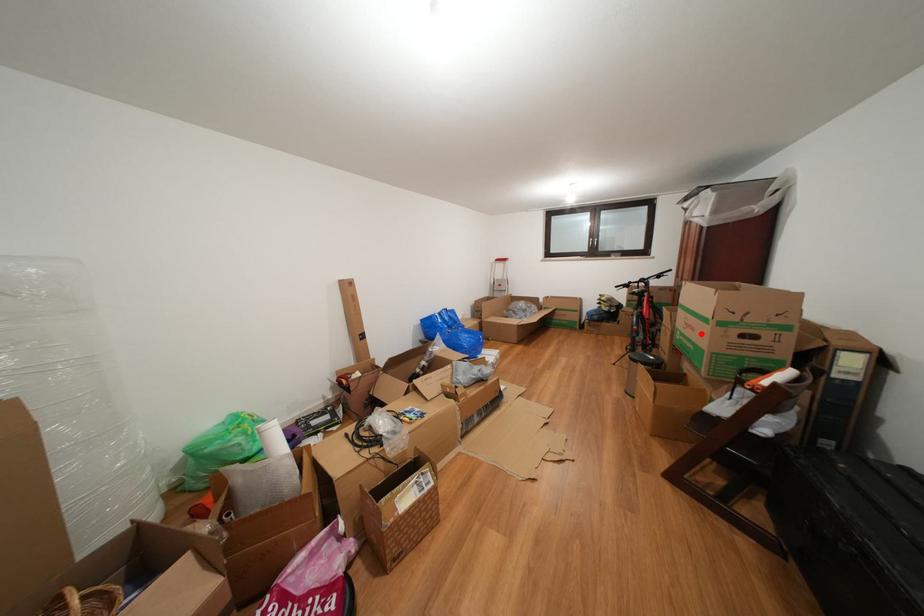
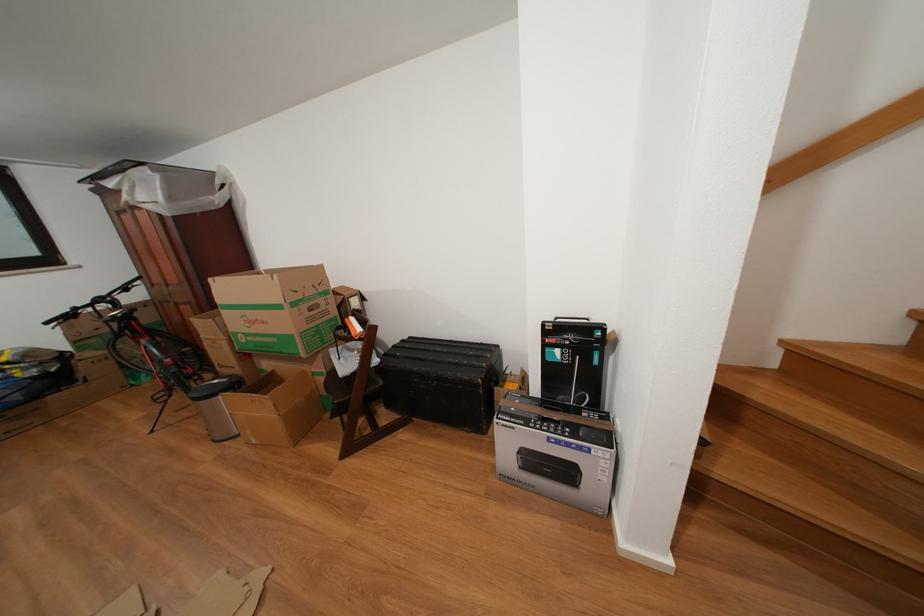
Question: I am providing you with two images of the same scene from different viewpoints. A red point is shown in image1. For the corresponding object point in image2, is it positioned nearer or farther from the camera?

Choices:
 (A) Nearer
 (B) Farther

Answer: (B)